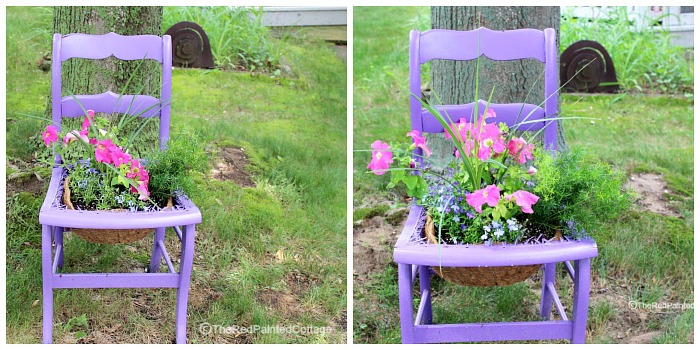
Where is `brown basket`? The width and height of the screenshot is (700, 350). brown basket is located at coordinates (130, 234), (465, 276).